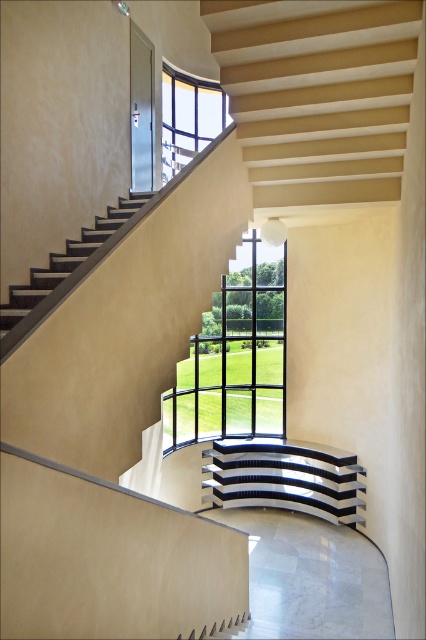
Question: Is black glass window at center to the right of clear glass window at upper center from the viewer's perspective?

Choices:
 (A) no
 (B) yes

Answer: (B)

Question: Can you confirm if black glass window at center is wider than polished chrome stair at center?

Choices:
 (A) yes
 (B) no

Answer: (B)

Question: Where is black glass window at center located in relation to clear glass window at upper center in the image?

Choices:
 (A) above
 (B) below

Answer: (B)

Question: Based on their relative distances, which object is farther from the black glass window at center?

Choices:
 (A) polished chrome stair at center
 (B) clear glass window at upper center

Answer: (B)

Question: Which point appears farthest from the camera in this image?

Choices:
 (A) pos(264,481)
 (B) pos(203,429)

Answer: (B)

Question: Which of these objects is positioned closest to the polished chrome stair at center?

Choices:
 (A) clear glass window at upper center
 (B) black glass window at center

Answer: (B)